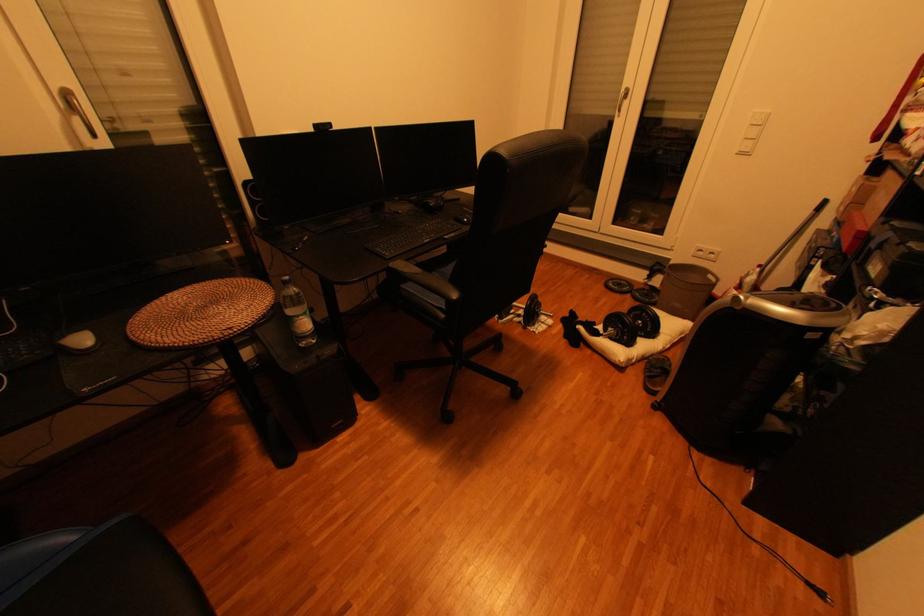
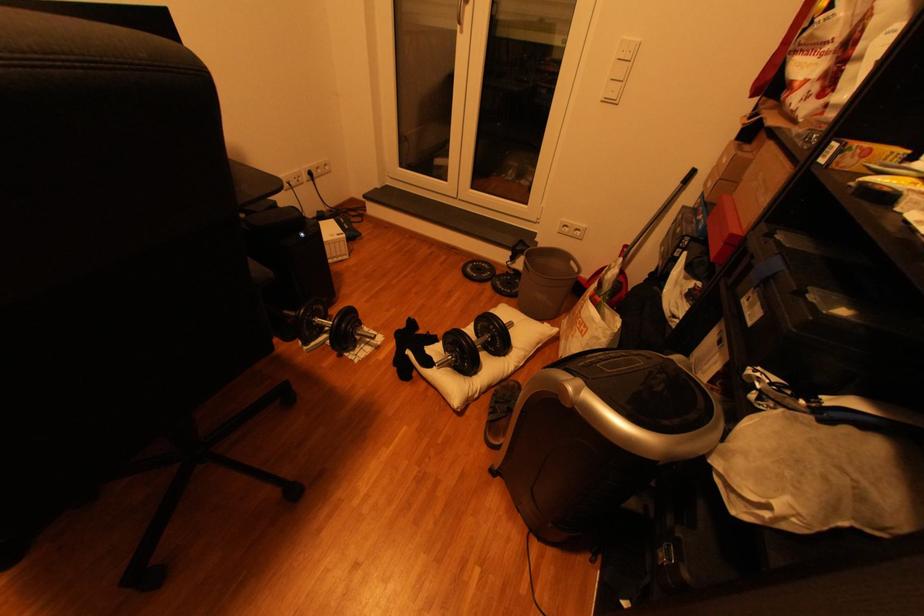
The point at (x=749, y=155) is marked in the first image. Where is the corresponding point in the second image?

(614, 100)